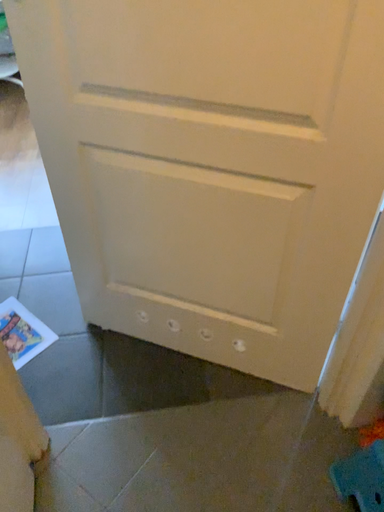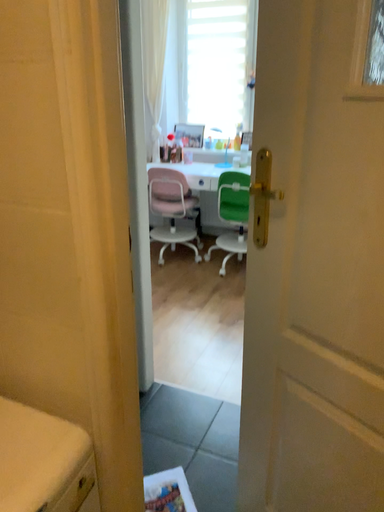
Question: How did the camera likely rotate when shooting the video?

Choices:
 (A) rotated upward
 (B) rotated downward

Answer: (A)